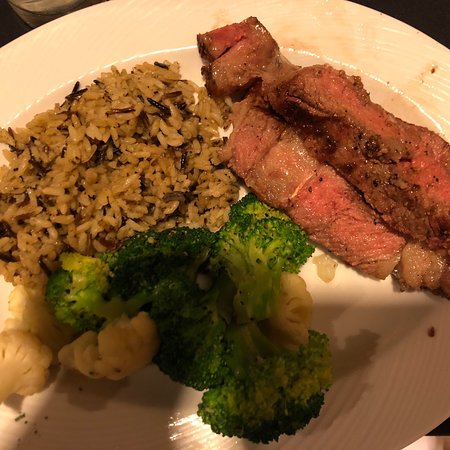
Image resolution: width=450 pixels, height=450 pixels. In order to click on light in this screenshot , I will do `click(197, 424)`.